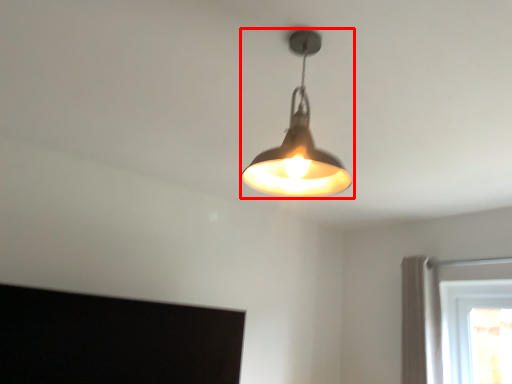
Question: From the image, what is the correct spatial relationship of lamp (annotated by the red box) in relation to curtain?

Choices:
 (A) right
 (B) left

Answer: (B)